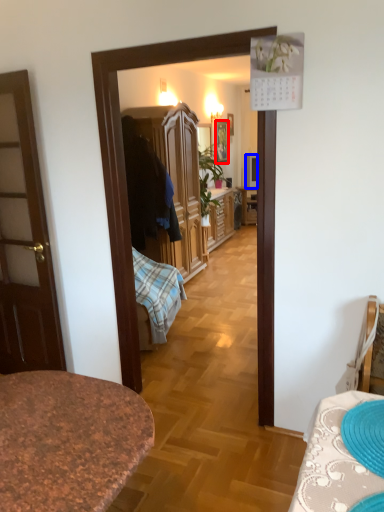
Question: Which of the following is the closest to the observer, picture frame (highlighted by a red box) or television (highlighted by a blue box)?

Choices:
 (A) picture frame
 (B) television

Answer: (A)